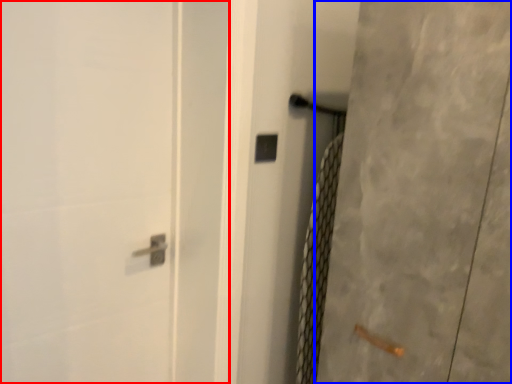
Question: Which object appears farthest to the camera in this image, screen door (highlighted by a red box) or screen door (highlighted by a blue box)?

Choices:
 (A) screen door
 (B) screen door

Answer: (A)